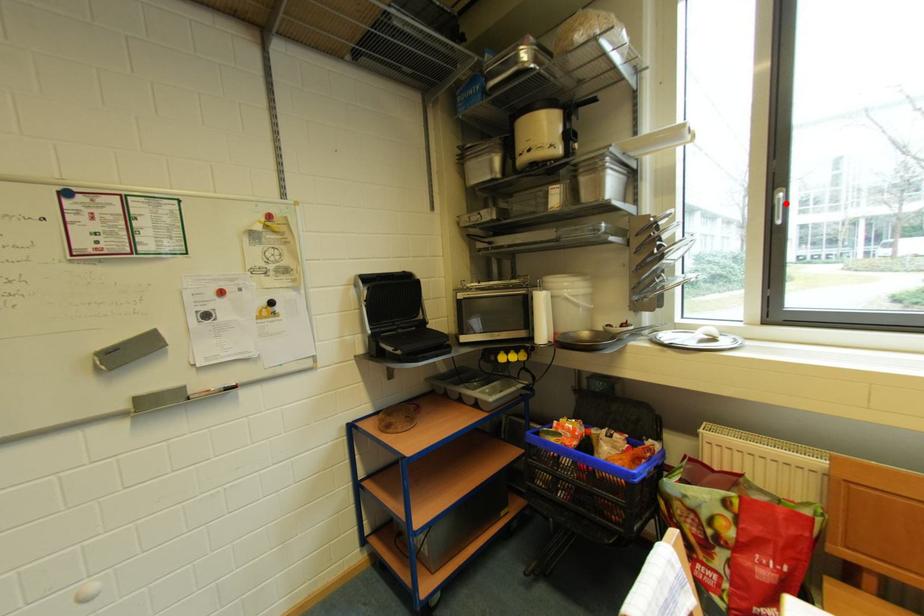
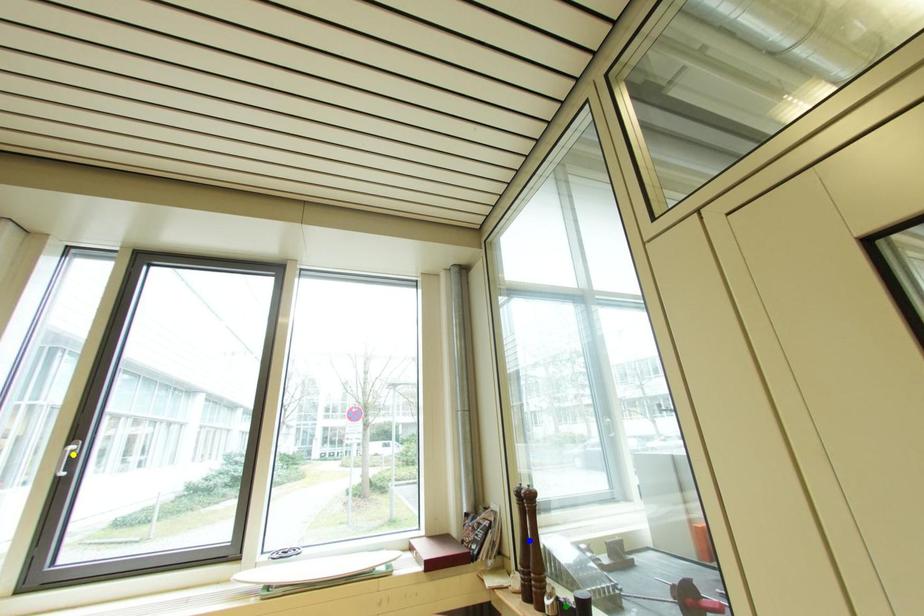
Question: I am providing you with two images of the same scene from different viewpoints. A red point is marked on the first image. You are given multiple points on the second image. In image 2, which mark is for the same physical point as the one in image 1?

Choices:
 (A) blue point
 (B) green point
 (C) yellow point

Answer: (C)